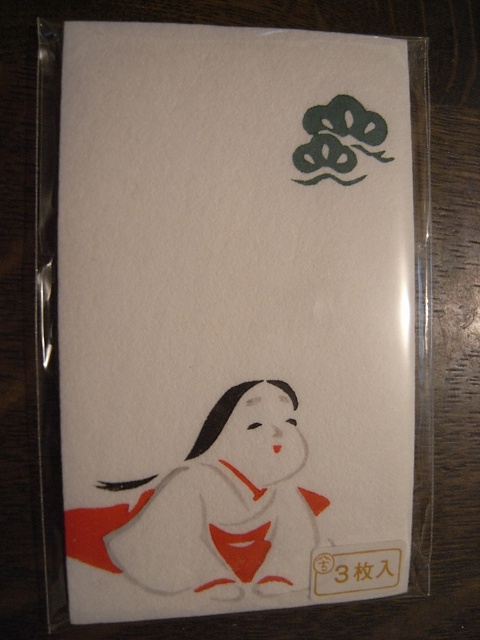
Question: Which of the following is the farthest from the observer?

Choices:
 (A) (181, 490)
 (B) (70, 152)

Answer: (A)

Question: Among these points, which one is farthest from the camera?

Choices:
 (A) (369, 180)
 (B) (244, 387)

Answer: (A)

Question: Can you confirm if white paper at center is positioned to the right of matte white kimono at lower left?

Choices:
 (A) yes
 (B) no

Answer: (A)

Question: Is white paper at center wider than matte white kimono at lower left?

Choices:
 (A) yes
 (B) no

Answer: (A)

Question: Which point is farther from the camera taking this photo?

Choices:
 (A) (343, 390)
 (B) (117, 529)

Answer: (A)

Question: Is white paper at center thinner than matte white kimono at lower left?

Choices:
 (A) no
 (B) yes

Answer: (A)